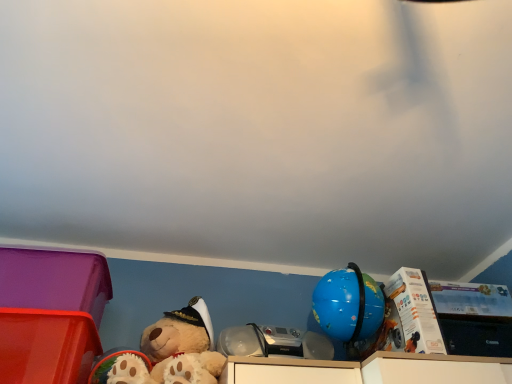
Locate an element on the screen. The height and width of the screenshot is (384, 512). free point below white cardboard box at upper right, acting as the 1th storage box starting from the right (from a real-world perspective) is located at coordinates (476, 332).